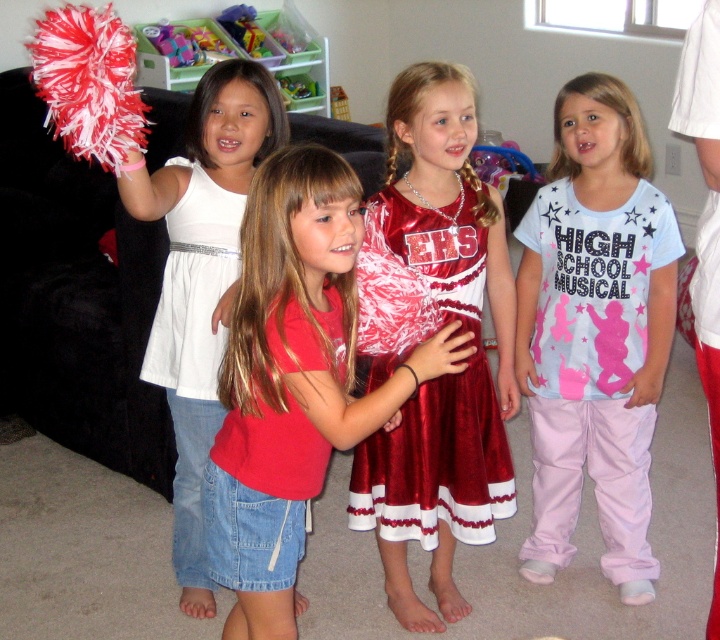
Question: Does light blue cotton shirt at center have a greater width compared to plush purple toy at center?

Choices:
 (A) no
 (B) yes

Answer: (A)

Question: Does light blue cotton shirt at center lie behind plush fabric pom-pom at upper left?

Choices:
 (A) yes
 (B) no

Answer: (B)

Question: Which object is closer to the camera taking this photo?

Choices:
 (A) plastic toy at upper center
 (B) plush purple toy at center
 (C) plush fabric pom-pom at upper left

Answer: (C)

Question: Which point appears closest to the camera in this image?

Choices:
 (A) (307, 26)
 (B) (181, 449)
 (C) (274, 547)
 (D) (225, 26)

Answer: (C)

Question: Can you confirm if red/white fluffy pom-pom at left is positioned to the right of plastic toy at upper center?

Choices:
 (A) yes
 (B) no

Answer: (A)

Question: Among these points, which one is nearest to the camera?

Choices:
 (A) (261, 54)
 (B) (76, 145)
 (C) (284, 76)
 (D) (235, 20)

Answer: (B)